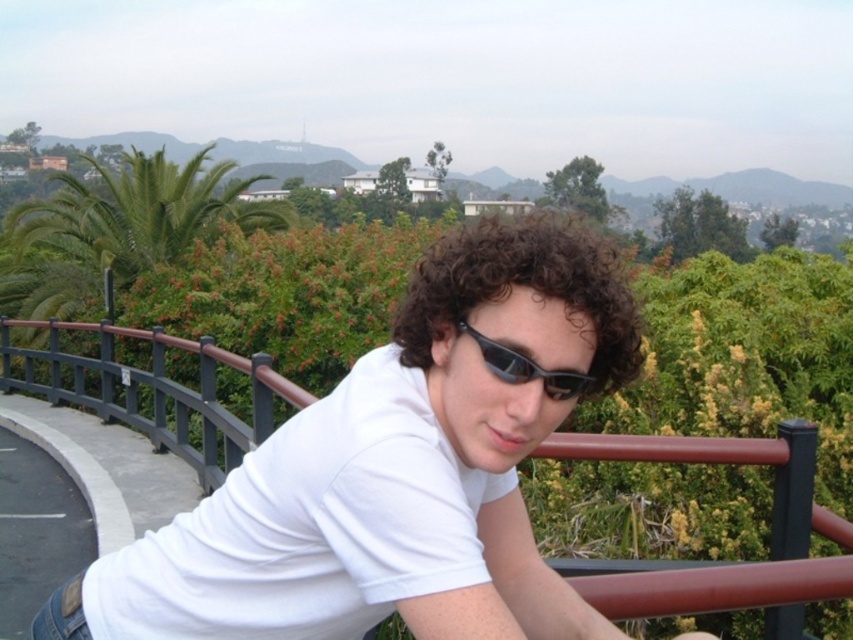
Is white matte shirt at center shorter than curly brown hair at center?

No, white matte shirt at center is not shorter than curly brown hair at center.

Does white matte shirt at center have a greater height compared to curly brown hair at center?

Yes, white matte shirt at center is taller than curly brown hair at center.

Is point (351, 480) positioned after point (598, 380)?

No, it is not.

At what (x,y) coordinates should I click in order to perform the action: click on white matte shirt at center. Please return your answer as a coordinate pair (x, y). Looking at the image, I should click on (393, 472).

Is curly brown hair at center below black plastic goggles at center?

No.

Does curly brown hair at center lie behind black plastic goggles at center?

That is True.

Image resolution: width=853 pixels, height=640 pixels. What are the coordinates of `curly brown hair at center` in the screenshot? It's located at (x=524, y=285).

From the picture: Which is more to the left, white matte shirt at center or black plastic goggles at center?

Positioned to the left is black plastic goggles at center.

Who is more forward, (556, 426) or (532, 364)?

Point (532, 364) is in front.

Locate an element on the screen. This screenshot has height=640, width=853. white matte shirt at center is located at coordinates (393, 472).